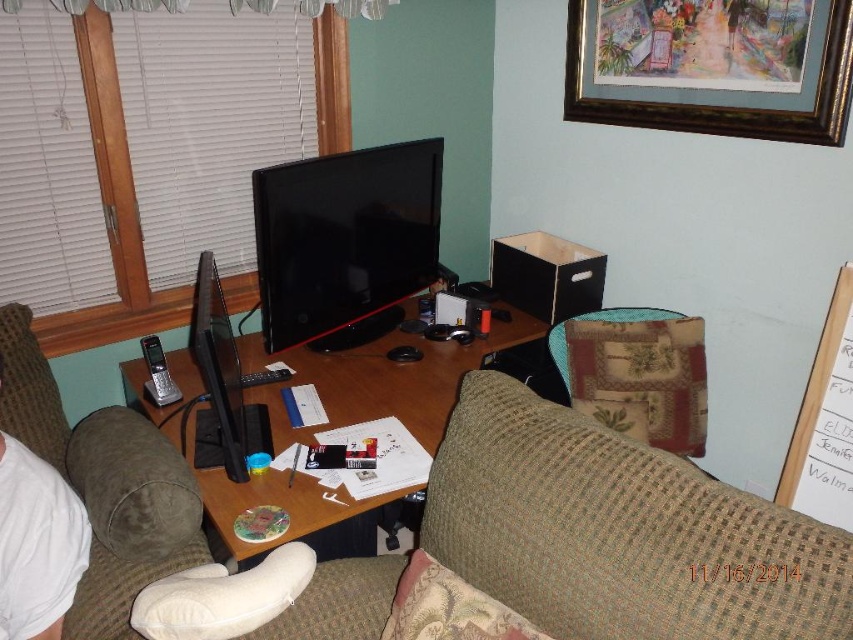
Question: Can you confirm if green fabric swivel chair at center is wider than black glossy computer monitor at center?

Choices:
 (A) yes
 (B) no

Answer: (A)

Question: Can you confirm if green fabric swivel chair at center is thinner than patchwork fabric armchair at center?

Choices:
 (A) no
 (B) yes

Answer: (A)

Question: Which of the following is the farthest from the observer?

Choices:
 (A) (432, 157)
 (B) (430, 385)

Answer: (A)

Question: Among these objects, which one is farthest from the camera?

Choices:
 (A) black glossy computer monitor at center
 (B) gold-framed artwork at upper right

Answer: (A)

Question: Which of these objects is positioned farthest from the black glossy computer desk at center?

Choices:
 (A) green fabric swivel chair at center
 (B) gold-framed artwork at upper right

Answer: (B)

Question: Does green fabric swivel chair at center have a larger size compared to gold-framed artwork at upper right?

Choices:
 (A) yes
 (B) no

Answer: (B)